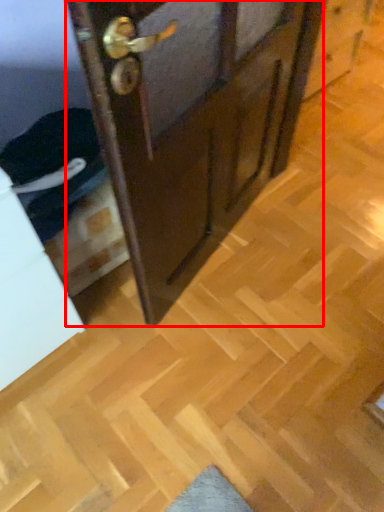
Question: Observing the image, what is the correct spatial positioning of door (annotated by the red box) in reference to drawer?

Choices:
 (A) left
 (B) right

Answer: (B)